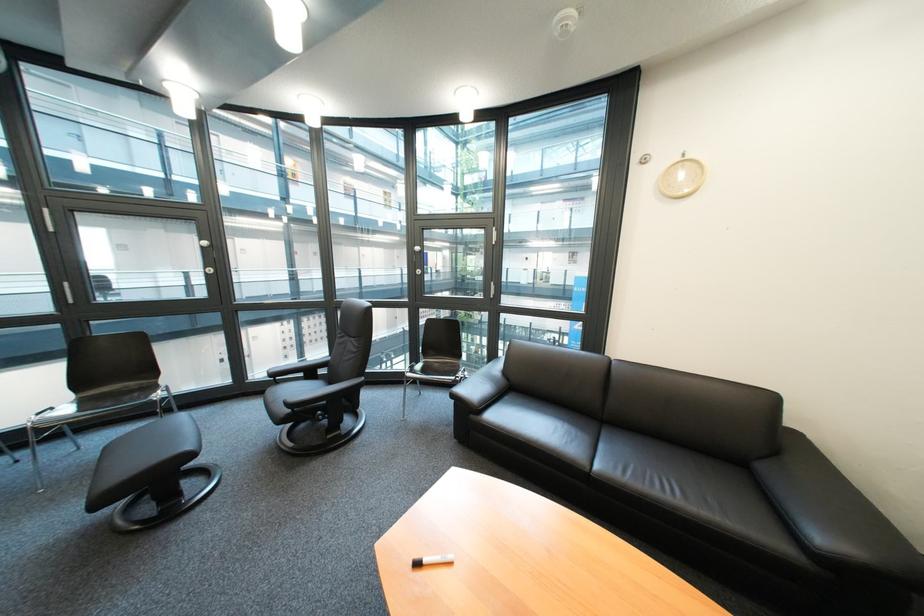
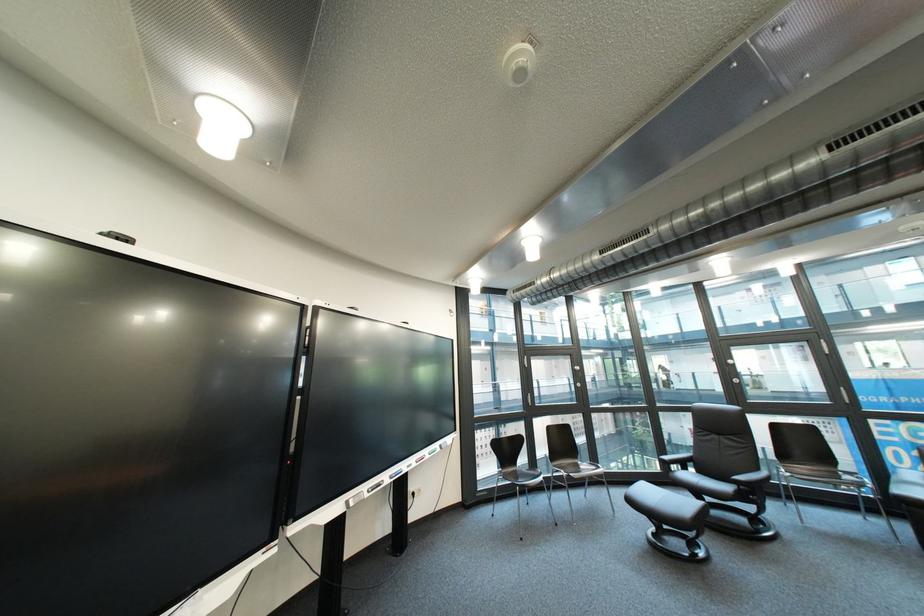
Locate, in the second image, the point that corresponds to point 467,379 in the first image.

(883, 485)